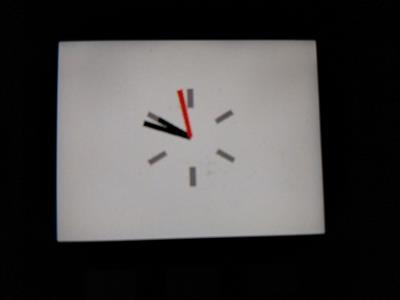
The width and height of the screenshot is (400, 300). I want to click on bottom right corner of white clock, so coord(325,233).